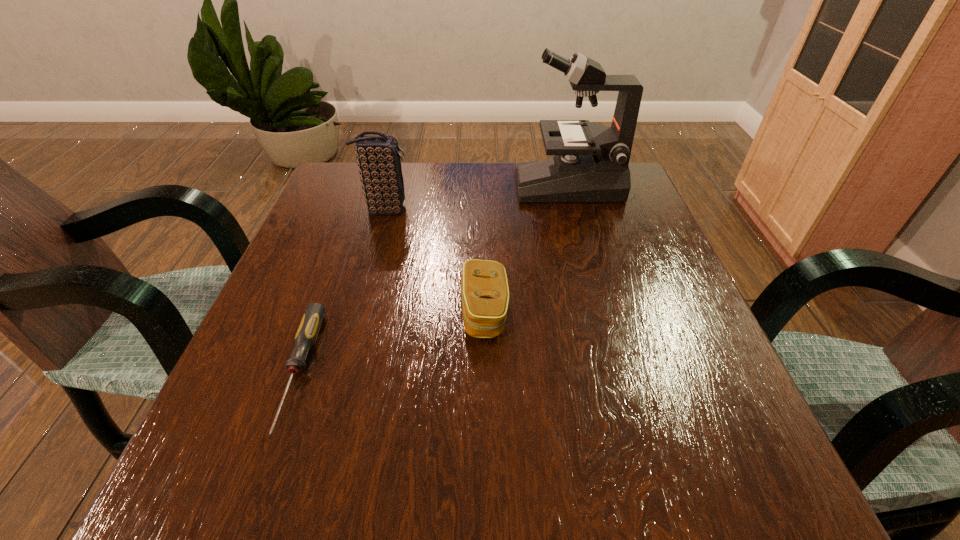
Find the location of `free point between the microscope and the nearer clutch bag`. free point between the microscope and the nearer clutch bag is located at coordinates (526, 248).

Locate an element on the screen. The height and width of the screenshot is (540, 960). empty location between the shortest object and the second object from right to left is located at coordinates (392, 341).

You are a GUI agent. You are given a task and a screenshot of the screen. Output one action in this format:
    pyautogui.click(x=<x>, y=<y>)
    Task: Click on the vacant area between the farther clutch bag and the rightmost object
    The width and height of the screenshot is (960, 540).
    Given the screenshot: What is the action you would take?
    pyautogui.click(x=476, y=197)

I want to click on free space between the left clutch bag and the shortest object, so click(342, 290).

Locate an element on the screen. This screenshot has width=960, height=540. vacant point located between the third shortest object and the shortest object is located at coordinates (342, 290).

At what (x,y) coordinates should I click in order to perform the action: click on free space between the right clutch bag and the shortest object. Please return your answer as a coordinate pair (x, y). This screenshot has height=540, width=960. Looking at the image, I should click on (392, 341).

This screenshot has width=960, height=540. Identify the location of vacant area between the shortest object and the third shortest object. (342, 290).

Where is `blank region between the rightmost object and the right clutch bag`? This screenshot has height=540, width=960. blank region between the rightmost object and the right clutch bag is located at coordinates (526, 248).

Locate an element on the screen. This screenshot has width=960, height=540. free space between the microscope and the second shortest object is located at coordinates (526, 248).

At what (x,y) coordinates should I click in order to perform the action: click on unoccupied position between the left clutch bag and the nearer clutch bag. Please return your answer as a coordinate pair (x, y). Image resolution: width=960 pixels, height=540 pixels. Looking at the image, I should click on (435, 260).